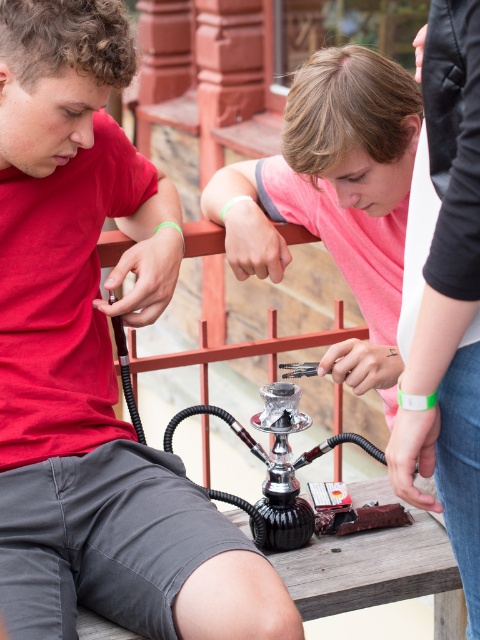
Between metallic shisha at center and shiny metallic hookah at center, which one has more height?

With more height is metallic shisha at center.

Is metallic shisha at center smaller than shiny metallic hookah at center?

Incorrect, metallic shisha at center is not smaller in size than shiny metallic hookah at center.

Locate an element on the screen. metallic shisha at center is located at coordinates (336, 196).

Does matte black hookah at center come behind metallic shisha at center?

No, it is in front of metallic shisha at center.

Is matte black hookah at center above metallic shisha at center?

Actually, matte black hookah at center is below metallic shisha at center.

Is point (88, 188) closer to camera compared to point (236, 163)?

Yes, point (88, 188) is closer to viewer.

The width and height of the screenshot is (480, 640). I want to click on matte black hookah at center, so click(95, 362).

Who is shorter, matte black hookah at center or shiny metallic hookah at center?

shiny metallic hookah at center is shorter.

Can you confirm if matte black hookah at center is positioned below shiny metallic hookah at center?

No.

Where is `matte black hookah at center`? matte black hookah at center is located at coordinates (95, 362).

At what (x,y) coordinates should I click in order to perform the action: click on matte black hookah at center. Please return your answer as a coordinate pair (x, y). Looking at the image, I should click on click(x=95, y=362).